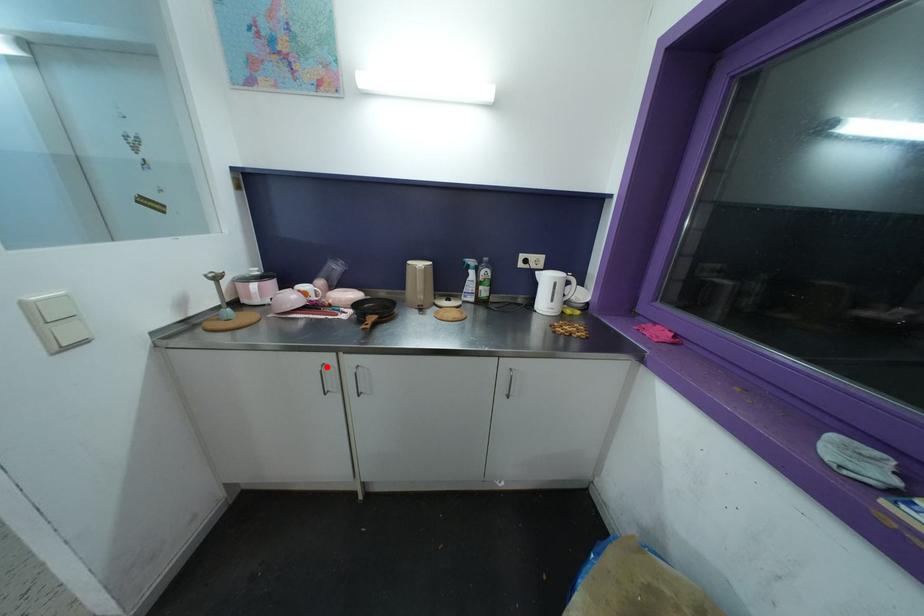
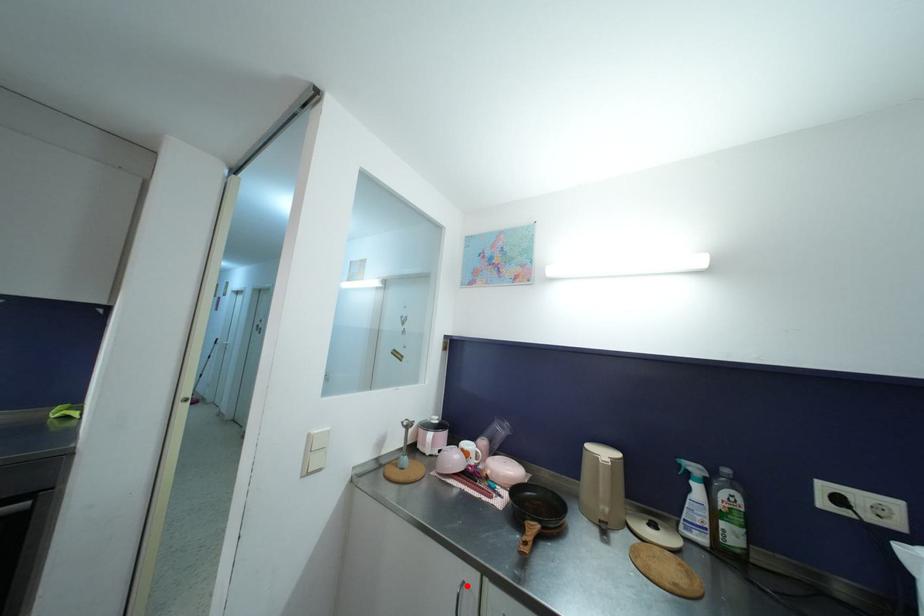
I am providing you with two images of the same scene from different viewpoints. A red point is marked on the first image and another point is marked on the second image. Do the highlighted points in image1 and image2 indicate the same real-world spot?

Yes